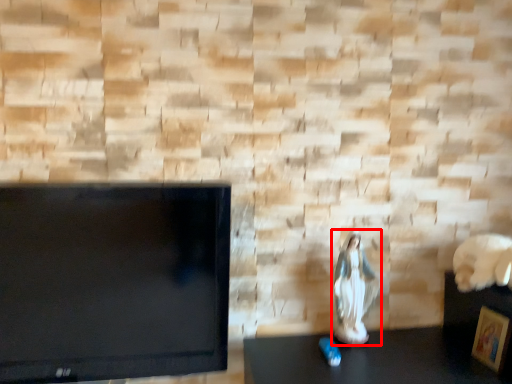
Question: Observing the image, what is the correct spatial positioning of couple (annotated by the red box) in reference to picture frame?

Choices:
 (A) right
 (B) left

Answer: (B)